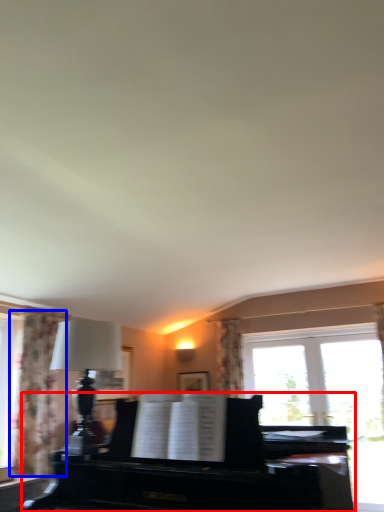
Question: Which object appears farthest to the camera in this image, piano (highlighted by a red box) or curtain (highlighted by a blue box)?

Choices:
 (A) piano
 (B) curtain

Answer: (B)